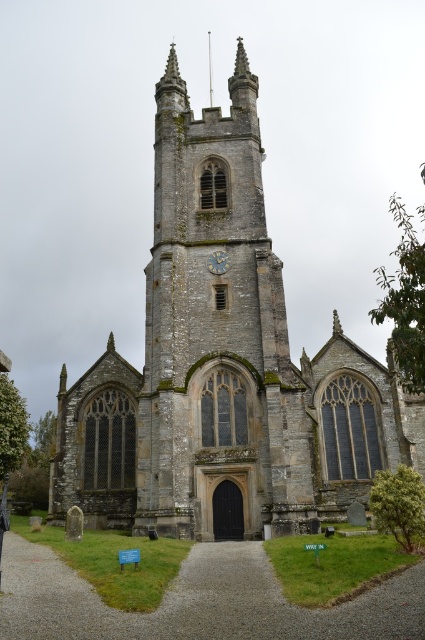
You are an architect planning to build a scale model of the stone church at center and the gold textured clock at center. If the clock in your model is 5 cm wide, what should be the minimum width of the church in your model to maintain accuracy?

The stone church at center is wider than the gold textured clock at center. Therefore, if the clock is 5 cm wide in the model, the church must be wider than 5 cm to maintain accuracy.

You are standing 100 meters away from the historic stone church. You want to walk towards the church and reach a specific point marked as point (x=70, y=484). How much further do you have to walk to reach that point?

The distance between point (x=70, y=484) and the viewer is 70.64 meters. Since you are currently 100 meters away from the church, you need to walk 29.36 meters further to reach point (x=70, y=484).

You are a drone operator who needs to deliver a small package to the gold textured clock at center of the stone church at center. The drone has a maximum delivery range of 15 meters. Can the drone reach the clock from the church?

The stone church at center and gold textured clock at center are 15.13 meters apart. Since the drone can only reach up to 15 meters, it cannot deliver the package as the distance is slightly over the limit.